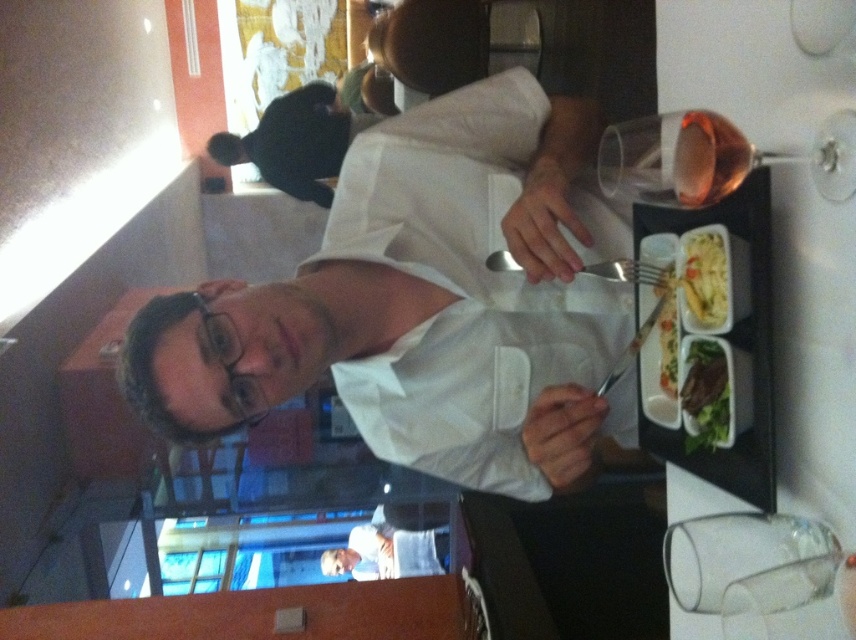
Is silver metallic fork at center wider than green leafy salad at upper right?

Yes.

Does silver metallic fork at center come in front of green leafy salad at upper right?

Yes.

The image size is (856, 640). I want to click on silver metallic fork at center, so click(632, 273).

Between white glossy pasta at upper right and green leafy salad at upper right, which one is positioned higher?

white glossy pasta at upper right is higher up.

Is white glossy pasta at upper right positioned at the back of green leafy salad at upper right?

No, it is not.

Is point (724, 278) closer to camera compared to point (667, 316)?

Yes, it is.

Locate an element on the screen. The width and height of the screenshot is (856, 640). white glossy pasta at upper right is located at coordinates (705, 276).

Can you confirm if rosé glass at upper right is positioned below black matte jacket at upper center?

Yes.

Does rosé glass at upper right have a larger size compared to black matte jacket at upper center?

Incorrect, rosé glass at upper right is not larger than black matte jacket at upper center.

At what (x,y) coordinates should I click in order to perform the action: click on rosé glass at upper right. Please return your answer as a coordinate pair (x, y). Image resolution: width=856 pixels, height=640 pixels. Looking at the image, I should click on (711, 157).